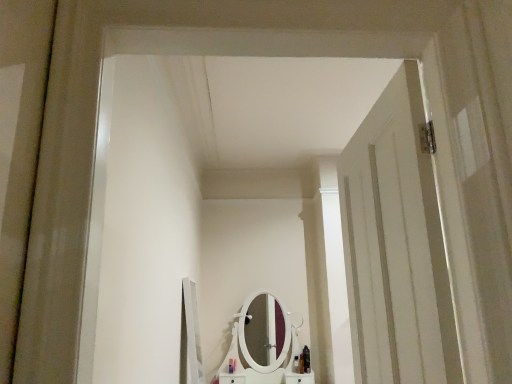
This screenshot has height=384, width=512. Describe the element at coordinates (396, 245) in the screenshot. I see `white wooden door at right` at that location.

What is the approximate width of translucent plastic bottle at center, marked as the 3th toiletry in a right-to-left arrangement?

translucent plastic bottle at center, marked as the 3th toiletry in a right-to-left arrangement, is 2.09 inches in width.

In order to face translucent plastic bottle at center, the 3th toiletry from the left, should I rotate leftwards or rightwards?

Rotate right and turn 5.602 degrees.

This screenshot has width=512, height=384. What do you see at coordinates (231, 366) in the screenshot?
I see `translucent plastic bottle at center, placed as the 1th toiletry when sorted from left to right` at bounding box center [231, 366].

Measure the distance between point [300,356] and camera.

A distance of 12.91 feet exists between point [300,356] and camera.

Describe the element at coordinates (306, 359) in the screenshot. The width and height of the screenshot is (512, 384). I see `shiny black bottle at lower center, the 5th toiletry viewed from the left` at that location.

Image resolution: width=512 pixels, height=384 pixels. Find the location of `shiny black bottle at lower center, which appears as the first toiletry when viewed from the right`. shiny black bottle at lower center, which appears as the first toiletry when viewed from the right is located at coordinates (306, 359).

Where is `white wooden door at right`? The width and height of the screenshot is (512, 384). white wooden door at right is located at coordinates (396, 245).

Considering the positions of objects translucent plastic bottle at center, the 3th toiletry from the left, and translucent plastic bottle at center, the 4th toiletry viewed from the right, in the image provided, who is more to the right, translucent plastic bottle at center, the 3th toiletry from the left, or translucent plastic bottle at center, the 4th toiletry viewed from the right,?

From the viewer's perspective, translucent plastic bottle at center, the 3th toiletry from the left, appears more on the right side.

Is point (298, 359) closer or farther from the camera than point (232, 363)?

Point (298, 359) appears to be farther away from the viewer than point (232, 363).

Is translucent plastic bottle at center, the 3th toiletry from the left, positioned beyond the bounds of translucent plastic bottle at center, the 4th toiletry viewed from the right?

Indeed, translucent plastic bottle at center, the 3th toiletry from the left, is completely outside translucent plastic bottle at center, the 4th toiletry viewed from the right.

Which object is further away from the camera, translucent plastic bottle at center, the 4th toiletry viewed from the right, or white wooden door at right?

Positioned behind is translucent plastic bottle at center, the 4th toiletry viewed from the right.

Find the location of a particular element. Image resolution: width=512 pixels, height=384 pixels. door on the right of translucent plastic bottle at center, which appears as the 2th toiletry when viewed from the left is located at coordinates coord(396,245).

Can white wooden door at right be found inside translucent plastic bottle at center, the 4th toiletry viewed from the right?

Actually, white wooden door at right is outside translucent plastic bottle at center, the 4th toiletry viewed from the right.

Between translucent plastic bottle at center, which appears as the 2th toiletry when viewed from the left, and white wooden door at right, which one appears on the right side from the viewer's perspective?

white wooden door at right is more to the right.

Based on their sizes in the image, would you say white wooden door at right is bigger or smaller than shiny black bottle at lower center, which appears as the first toiletry when viewed from the right?

In the image, white wooden door at right appears to be larger than shiny black bottle at lower center, which appears as the first toiletry when viewed from the right.

Can you confirm if white wooden door at right is taller than shiny black bottle at lower center, which appears as the first toiletry when viewed from the right?

Correct, white wooden door at right is much taller as shiny black bottle at lower center, which appears as the first toiletry when viewed from the right.

Is white wooden door at right wider or thinner than shiny black bottle at lower center, which appears as the first toiletry when viewed from the right?

white wooden door at right is wider than shiny black bottle at lower center, which appears as the first toiletry when viewed from the right.

You are a GUI agent. You are given a task and a screenshot of the screen. Output one action in this format:
    pyautogui.click(x=<x>, y=<y>)
    Task: Click on the door in front of the shiny black bottle at lower center, which appears as the first toiletry when viewed from the right
    This screenshot has height=384, width=512.
    Given the screenshot: What is the action you would take?
    pyautogui.click(x=396, y=245)

Would you consider translucent plastic bottle at center, which appears as the 2th toiletry when viewed from the left, to be distant from translucent plastic bottle at center, marked as the 3th toiletry in a right-to-left arrangement?

No, translucent plastic bottle at center, which appears as the 2th toiletry when viewed from the left, is not far from translucent plastic bottle at center, marked as the 3th toiletry in a right-to-left arrangement.

Is translucent plastic bottle at center, the 4th toiletry viewed from the right, taller than translucent plastic bottle at center, the 3th toiletry from the left?

No, translucent plastic bottle at center, the 4th toiletry viewed from the right, is not taller than translucent plastic bottle at center, the 3th toiletry from the left.

Is translucent plastic bottle at center, which appears as the 2th toiletry when viewed from the left, inside the boundaries of translucent plastic bottle at center, the 3th toiletry from the left, or outside?

translucent plastic bottle at center, which appears as the 2th toiletry when viewed from the left, exists outside the volume of translucent plastic bottle at center, the 3th toiletry from the left.

How many degrees apart are the facing directions of translucent plastic bottle at center, the 4th toiletry viewed from the right, and translucent plastic bottle at center, the 3th toiletry from the left?

There is a 0.000234-degree angle between the facing directions of translucent plastic bottle at center, the 4th toiletry viewed from the right, and translucent plastic bottle at center, the 3th toiletry from the left.

Does shiny black bottle at lower center, which appears as the first toiletry when viewed from the right, have a lesser width compared to white wooden door at right?

Yes, shiny black bottle at lower center, which appears as the first toiletry when viewed from the right, is thinner than white wooden door at right.

Based on the photo, is shiny black bottle at lower center, which appears as the first toiletry when viewed from the right, looking in the opposite direction of white wooden door at right?

shiny black bottle at lower center, which appears as the first toiletry when viewed from the right, is not turned away from white wooden door at right.

Between shiny black bottle at lower center, the 5th toiletry viewed from the left, and white wooden door at right, which one has smaller size?

shiny black bottle at lower center, the 5th toiletry viewed from the left, is smaller.

Based on the photo, measure the distance between shiny black bottle at lower center, the 5th toiletry viewed from the left, and white wooden door at right.

shiny black bottle at lower center, the 5th toiletry viewed from the left, is 9.82 feet from white wooden door at right.

From the image's perspective, between translucent plastic bottle at center, marked as the 3th toiletry in a right-to-left arrangement, and translucent plastic bottle at center, placed as the 1th toiletry when sorted from left to right, who is located below?

translucent plastic bottle at center, placed as the 1th toiletry when sorted from left to right.

Which is in front, point (292, 366) or point (231, 372)?

The point (231, 372) is closer.

How far apart are translucent plastic bottle at center, the 3th toiletry from the left, and translucent plastic bottle at center, positioned as the 5th toiletry in right-to-left order?

A distance of 22.12 inches exists between translucent plastic bottle at center, the 3th toiletry from the left, and translucent plastic bottle at center, positioned as the 5th toiletry in right-to-left order.

Is translucent plastic bottle at center, the 3th toiletry from the left, in front of or behind translucent plastic bottle at center, positioned as the 5th toiletry in right-to-left order, in the image?

Clearly, translucent plastic bottle at center, the 3th toiletry from the left, is behind translucent plastic bottle at center, positioned as the 5th toiletry in right-to-left order.

Is point (298, 371) behind point (305, 359)?

No, it is not.

Considering the positions of objects translucent plastic bottle at center, marked as the 3th toiletry in a right-to-left arrangement, and shiny black bottle at lower center, the 5th toiletry viewed from the left, in the image provided, who is behind, translucent plastic bottle at center, marked as the 3th toiletry in a right-to-left arrangement, or shiny black bottle at lower center, the 5th toiletry viewed from the left,?

translucent plastic bottle at center, marked as the 3th toiletry in a right-to-left arrangement, is further from the camera.

Is translucent plastic bottle at center, the 3th toiletry from the left, oriented towards shiny black bottle at lower center, which appears as the first toiletry when viewed from the right?

No, translucent plastic bottle at center, the 3th toiletry from the left, is not turned towards shiny black bottle at lower center, which appears as the first toiletry when viewed from the right.

Image resolution: width=512 pixels, height=384 pixels. Identify the location of toiletry that is the 3rd one when counting backward from the translucent plastic bottle at center, which appears as the 2th toiletry when viewed from the left. (296, 364).

Where is `door that appears above the translucent plastic bottle at center, the 4th toiletry viewed from the right (from a real-world perspective)`? Image resolution: width=512 pixels, height=384 pixels. door that appears above the translucent plastic bottle at center, the 4th toiletry viewed from the right (from a real-world perspective) is located at coordinates (396, 245).

When comparing their distances from shiny black bottle at center, the 4th toiletry from the left, does translucent plastic bottle at center, the 3th toiletry from the left, or translucent plastic bottle at center, which appears as the 2th toiletry when viewed from the left, seem closer?

The object closer to shiny black bottle at center, the 4th toiletry from the left, is translucent plastic bottle at center, the 3th toiletry from the left.

When comparing their distances from translucent plastic bottle at center, marked as the 3th toiletry in a right-to-left arrangement, does translucent plastic bottle at center, which appears as the 2th toiletry when viewed from the left, or white wooden door at right seem closer?

The object closer to translucent plastic bottle at center, marked as the 3th toiletry in a right-to-left arrangement, is translucent plastic bottle at center, which appears as the 2th toiletry when viewed from the left.

Which object lies nearer to the anchor point translucent plastic bottle at center, marked as the 3th toiletry in a right-to-left arrangement, translucent plastic bottle at center, positioned as the 5th toiletry in right-to-left order, or shiny black bottle at center, the 4th toiletry from the left?

shiny black bottle at center, the 4th toiletry from the left, is positioned closer to the anchor translucent plastic bottle at center, marked as the 3th toiletry in a right-to-left arrangement.

Based on their spatial positions, is translucent plastic bottle at center, marked as the 3th toiletry in a right-to-left arrangement, or translucent plastic bottle at center, which appears as the 2th toiletry when viewed from the left, closer to translucent plastic bottle at center, placed as the 1th toiletry when sorted from left to right?

translucent plastic bottle at center, which appears as the 2th toiletry when viewed from the left.

When comparing their distances from white wooden door at right, does translucent plastic bottle at center, which appears as the 2th toiletry when viewed from the left, or translucent plastic bottle at center, marked as the 3th toiletry in a right-to-left arrangement, seem further?

translucent plastic bottle at center, which appears as the 2th toiletry when viewed from the left, is further to white wooden door at right.

Based on their spatial positions, is shiny black bottle at lower center, which appears as the first toiletry when viewed from the right, or white wooden door at right closer to translucent plastic bottle at center, positioned as the 5th toiletry in right-to-left order?

shiny black bottle at lower center, which appears as the first toiletry when viewed from the right, is closer to translucent plastic bottle at center, positioned as the 5th toiletry in right-to-left order.

Estimate the real-world distances between objects in this image. Which object is further from translucent plastic bottle at center, positioned as the 5th toiletry in right-to-left order, translucent plastic bottle at center, the 4th toiletry viewed from the right, or shiny black bottle at lower center, the 5th toiletry viewed from the left?

Based on the image, shiny black bottle at lower center, the 5th toiletry viewed from the left, appears to be further to translucent plastic bottle at center, positioned as the 5th toiletry in right-to-left order.

Estimate the real-world distances between objects in this image. Which object is further from shiny black bottle at center, the 4th toiletry from the left, translucent plastic bottle at center, positioned as the 5th toiletry in right-to-left order, or white wooden door at right?

white wooden door at right.

At what (x,y) coordinates should I click in order to perform the action: click on toiletry located between white wooden door at right and translucent plastic bottle at center, which appears as the 2th toiletry when viewed from the left, in the depth direction. Please return your answer as a coordinate pair (x, y). Looking at the image, I should click on (301, 364).

Identify the location of toiletry situated between translucent plastic bottle at center, positioned as the 5th toiletry in right-to-left order, and translucent plastic bottle at center, the 3th toiletry from the left, from left to right. (232, 365).

Find the location of a particular element. toiletry situated between translucent plastic bottle at center, the 4th toiletry viewed from the right, and shiny black bottle at center, which appears as the 2th toiletry when viewed from the right, from left to right is located at coordinates (296, 364).

Find the location of a particular element. toiletry located between translucent plastic bottle at center, marked as the 3th toiletry in a right-to-left arrangement, and shiny black bottle at lower center, which appears as the first toiletry when viewed from the right, in the left-right direction is located at coordinates (301, 364).